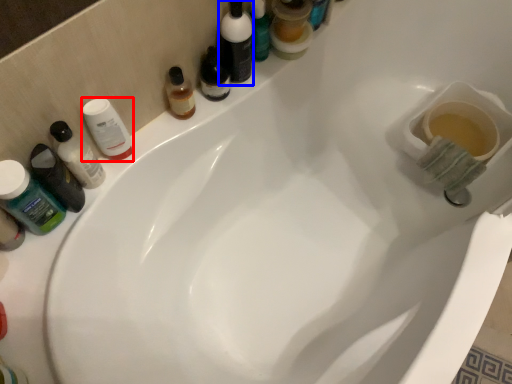
Question: Which point is closer to the camera, mouthwash (highlighted by a red box) or toiletry (highlighted by a blue box)?

Choices:
 (A) mouthwash
 (B) toiletry

Answer: (A)